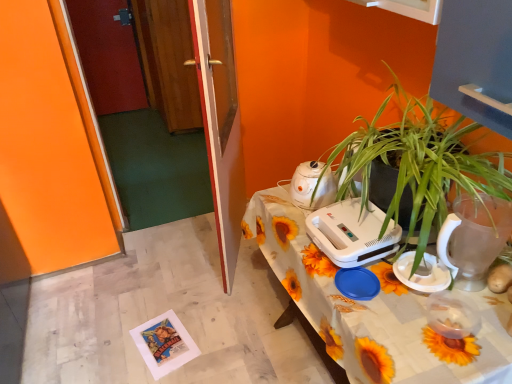
I want to click on vacant space in front of transparent glass door at center, which is the 1th glass door from front to back, so click(x=211, y=311).